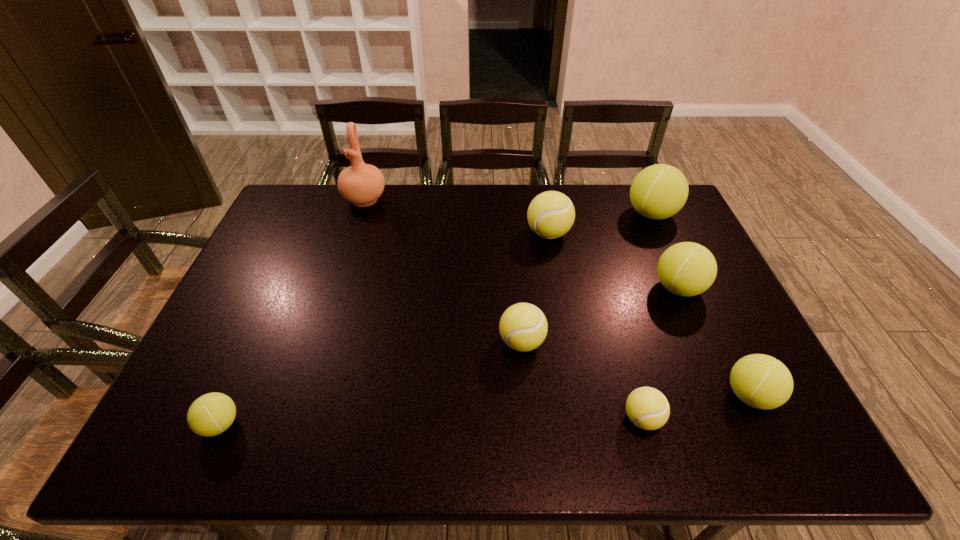
What are the coordinates of `vacant space at the right edge of the desktop` in the screenshot? It's located at (672, 239).

You are a GUI agent. You are given a task and a screenshot of the screen. Output one action in this format:
    pyautogui.click(x=<x>, y=<y>)
    Task: Click on the vacant space at the near right corner
    Image resolution: width=960 pixels, height=540 pixels.
    Given the screenshot: What is the action you would take?
    pyautogui.click(x=744, y=434)

This screenshot has height=540, width=960. What are the coordinates of `free space that is in between the second farthest green tennis ball and the farthest yellow tennis ball` in the screenshot? It's located at (613, 261).

You are a GUI agent. You are given a task and a screenshot of the screen. Output one action in this format:
    pyautogui.click(x=<x>, y=<y>)
    Task: Click on the free space between the fifth farthest object and the fifth nearest object
    The image size is (960, 540).
    Given the screenshot: What is the action you would take?
    pyautogui.click(x=600, y=315)

This screenshot has height=540, width=960. Find the location of `free space that is in between the fourth farthest tennis ball and the leftmost object`. free space that is in between the fourth farthest tennis ball and the leftmost object is located at coordinates (372, 383).

Identify the location of vacant space that's between the third biggest green tennis ball and the biggest green tennis ball. (701, 305).

Identify the location of vacant area that lies between the farthest yellow tennis ball and the farthest green tennis ball. (600, 224).

Identify the location of free space that is in between the third biggest green tennis ball and the fourth farthest object. (714, 342).

Where is `free spot between the second smallest green tennis ball and the seventh object from right to left`? This screenshot has width=960, height=540. free spot between the second smallest green tennis ball and the seventh object from right to left is located at coordinates (557, 298).

This screenshot has width=960, height=540. Find the location of `vacant area between the tallest object and the smallest green tennis ball`. vacant area between the tallest object and the smallest green tennis ball is located at coordinates (293, 312).